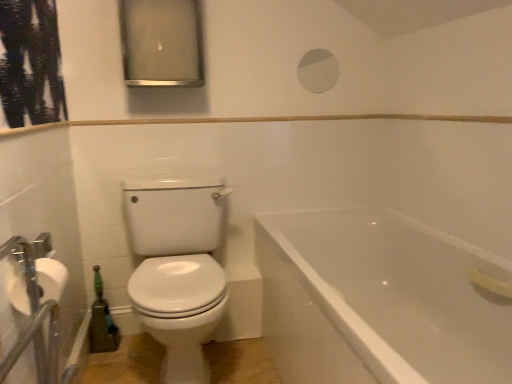
Question: Is matte silver medicine cabinet at upper center looking in the opposite direction of white glossy mirror at upper center?

Choices:
 (A) no
 (B) yes

Answer: (A)

Question: Would you say matte silver medicine cabinet at upper center is a long distance from white glossy mirror at upper center?

Choices:
 (A) no
 (B) yes

Answer: (A)

Question: Does matte silver medicine cabinet at upper center have a lesser width compared to white glossy mirror at upper center?

Choices:
 (A) yes
 (B) no

Answer: (B)

Question: Is matte silver medicine cabinet at upper center bigger than white glossy mirror at upper center?

Choices:
 (A) no
 (B) yes

Answer: (B)

Question: Does matte silver medicine cabinet at upper center have a lesser height compared to white glossy mirror at upper center?

Choices:
 (A) yes
 (B) no

Answer: (B)

Question: Is matte silver medicine cabinet at upper center outside white glossy mirror at upper center?

Choices:
 (A) yes
 (B) no

Answer: (A)

Question: Is white glossy bathtub at lower right to the right of white glossy mirror at upper center from the viewer's perspective?

Choices:
 (A) yes
 (B) no

Answer: (A)

Question: Considering the relative sizes of white glossy bathtub at lower right and white glossy mirror at upper center in the image provided, is white glossy bathtub at lower right shorter than white glossy mirror at upper center?

Choices:
 (A) no
 (B) yes

Answer: (A)

Question: Could you tell me if white glossy bathtub at lower right is turned towards white glossy mirror at upper center?

Choices:
 (A) yes
 (B) no

Answer: (B)

Question: Are white glossy bathtub at lower right and white glossy mirror at upper center located far from each other?

Choices:
 (A) yes
 (B) no

Answer: (A)

Question: Is white glossy bathtub at lower right to the left of white glossy mirror at upper center from the viewer's perspective?

Choices:
 (A) yes
 (B) no

Answer: (B)

Question: From a real-world perspective, is white glossy bathtub at lower right on top of white glossy mirror at upper center?

Choices:
 (A) yes
 (B) no

Answer: (B)

Question: Does white glossy toilet at left lie in front of matte silver medicine cabinet at upper center?

Choices:
 (A) no
 (B) yes

Answer: (B)